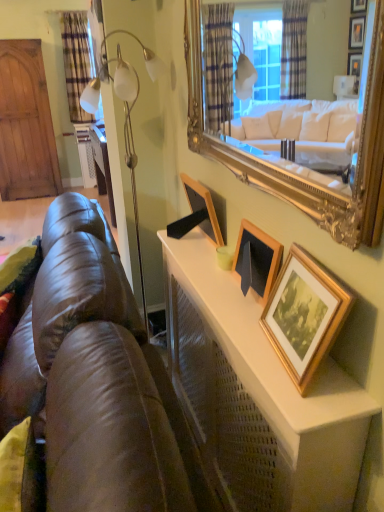
Describe the element at coordinates (303, 169) in the screenshot. Image resolution: width=384 pixels, height=512 pixels. I see `gold ornate mirror at upper center` at that location.

Describe the element at coordinates (304, 315) in the screenshot. This screenshot has width=384, height=512. I see `gold wooden picture frame at upper right, which is the third picture frame from back to front` at that location.

Locate an element on the screen. Image resolution: width=384 pixels, height=512 pixels. wooden picture frame at upper center, which is counted as the third picture frame, starting from the front is located at coordinates tap(203, 207).

Based on their positions, is gold wooden picture frame at upper right, which appears as the 1th picture frame when viewed from the front, located to the left or right of plaid fabric curtain at upper left?

In the image, gold wooden picture frame at upper right, which appears as the 1th picture frame when viewed from the front, appears on the right side of plaid fabric curtain at upper left.

Which object is wider, gold wooden picture frame at upper right, the first picture frame in the right-to-left sequence, or plaid fabric curtain at upper left?

With larger width is plaid fabric curtain at upper left.

This screenshot has width=384, height=512. Find the location of `curtain that appears above the gold wooden picture frame at upper right, which is the third picture frame from back to front (from a real-world perspective)`. curtain that appears above the gold wooden picture frame at upper right, which is the third picture frame from back to front (from a real-world perspective) is located at coordinates pos(76,62).

From a real-world perspective, is gold wooden picture frame at upper right, the first picture frame in the right-to-left sequence, physically above plaid fabric curtain at upper left?

No, from a real-world perspective, gold wooden picture frame at upper right, the first picture frame in the right-to-left sequence, is not over plaid fabric curtain at upper left

Is gold wooden picture frame at upper right, which appears as the 1th picture frame when viewed from the front, far away from brown leather couch at lower left?

gold wooden picture frame at upper right, which appears as the 1th picture frame when viewed from the front, is near brown leather couch at lower left, not far away.

Looking at this image, from the image's perspective, does gold wooden picture frame at upper right, the first picture frame in the right-to-left sequence, appear lower than brown leather couch at lower left?

No, from the image's perspective, gold wooden picture frame at upper right, the first picture frame in the right-to-left sequence, is not beneath brown leather couch at lower left.

In the scene shown: Which object is positioned more to the right, gold wooden picture frame at upper right, which is the third picture frame from back to front, or brown leather couch at lower left?

gold wooden picture frame at upper right, which is the third picture frame from back to front, is more to the right.

In the scene shown: Considering their positions, is gold wooden picture frame at upper right, the third picture frame positioned from the left, located in front of or behind brown leather couch at lower left?

Visually, gold wooden picture frame at upper right, the third picture frame positioned from the left, is located behind brown leather couch at lower left.

From the image's perspective, is gold wooden picture frame at upper right, which appears as the 1th picture frame when viewed from the front, over wooden picture frame at upper center, which is the first picture frame in back-to-front order?

No, from the image's perspective, gold wooden picture frame at upper right, which appears as the 1th picture frame when viewed from the front, is not over wooden picture frame at upper center, which is the first picture frame in back-to-front order.

How different are the orientations of gold wooden picture frame at upper right, which is the third picture frame from back to front, and wooden picture frame at upper center, which ranks as the 1th picture frame in left-to-right order, in degrees?

The angle between the facing direction of gold wooden picture frame at upper right, which is the third picture frame from back to front, and the facing direction of wooden picture frame at upper center, which ranks as the 1th picture frame in left-to-right order, is 0.0124 degrees.

Is gold wooden picture frame at upper right, the first picture frame in the right-to-left sequence, positioned with its back to wooden picture frame at upper center, which is the first picture frame in back-to-front order?

That's not correct — gold wooden picture frame at upper right, the first picture frame in the right-to-left sequence, is not looking away from wooden picture frame at upper center, which is the first picture frame in back-to-front order.

Considering the relative positions of gold wooden picture frame at upper right, the first picture frame in the right-to-left sequence, and wooden picture frame at upper center, which is the first picture frame in back-to-front order, in the image provided, is gold wooden picture frame at upper right, the first picture frame in the right-to-left sequence, to the left of wooden picture frame at upper center, which is the first picture frame in back-to-front order, from the viewer's perspective?

Incorrect, gold wooden picture frame at upper right, the first picture frame in the right-to-left sequence, is not on the left side of wooden picture frame at upper center, which is the first picture frame in back-to-front order.

Which is in front, point (137, 345) or point (199, 14)?

The point (137, 345) is closer to the camera.

Considering the relative sizes of brown leather couch at lower left and gold ornate mirror at upper center in the image provided, is brown leather couch at lower left thinner than gold ornate mirror at upper center?

No.

From a real-world perspective, is brown leather couch at lower left above or below gold ornate mirror at upper center?

brown leather couch at lower left is situated lower than gold ornate mirror at upper center in the real world.

Would you say brown leather couch at lower left is a long distance from gold ornate mirror at upper center?

No, there isn't a large distance between brown leather couch at lower left and gold ornate mirror at upper center.

Would you consider wooden picture frame at center, the 2th picture frame viewed from the left, to be distant from brown leather couch at lower left?

No, wooden picture frame at center, the 2th picture frame viewed from the left, is not far away from brown leather couch at lower left.

This screenshot has width=384, height=512. I want to click on studio couch below the wooden picture frame at center, marked as the 2th picture frame in a right-to-left arrangement (from a real-world perspective), so click(96, 380).

Would you say wooden picture frame at center, the 2th picture frame viewed from the left, is inside or outside brown leather couch at lower left?

wooden picture frame at center, the 2th picture frame viewed from the left, lies outside brown leather couch at lower left.

Is wooden picture frame at upper center, which is the first picture frame in back-to-front order, in contact with gold wooden picture frame at upper right, the first picture frame in the right-to-left sequence?

No, wooden picture frame at upper center, which is the first picture frame in back-to-front order, is not with gold wooden picture frame at upper right, the first picture frame in the right-to-left sequence.

Is wooden picture frame at upper center, which is the first picture frame in back-to-front order, behind gold wooden picture frame at upper right, which is the third picture frame from back to front?

That is True.

Is point (210, 226) closer or farther from the camera than point (288, 270)?

Point (210, 226) appears to be farther away from the viewer than point (288, 270).

Do you think wooden picture frame at upper center, which is counted as the third picture frame, starting from the front, is within gold wooden picture frame at upper right, which is the third picture frame from back to front, or outside of it?

wooden picture frame at upper center, which is counted as the third picture frame, starting from the front, is spatially situated outside gold wooden picture frame at upper right, which is the third picture frame from back to front.

Is gold wooden picture frame at upper right, the first picture frame in the right-to-left sequence, aimed at gold ornate mirror at upper center?

No, gold wooden picture frame at upper right, the first picture frame in the right-to-left sequence, is not aimed at gold ornate mirror at upper center.

From the image's perspective, between gold wooden picture frame at upper right, which appears as the 1th picture frame when viewed from the front, and gold ornate mirror at upper center, who is located below?

gold wooden picture frame at upper right, which appears as the 1th picture frame when viewed from the front, from the image's perspective.

Considering the positions of objects gold wooden picture frame at upper right, which appears as the 1th picture frame when viewed from the front, and gold ornate mirror at upper center in the image provided, who is more to the left, gold wooden picture frame at upper right, which appears as the 1th picture frame when viewed from the front, or gold ornate mirror at upper center?

Positioned to the left is gold ornate mirror at upper center.

Which point is more forward, (283, 322) or (371, 69)?

Positioned in front is point (371, 69).

Find the location of a particular element. This screenshot has width=384, height=512. the 3rd picture frame to the right of the plaid fabric curtain at upper left, starting your count from the anchor is located at coordinates (304, 315).

At what (x,y) coordinates should I click in order to perform the action: click on studio couch below the gold wooden picture frame at upper right, which appears as the 1th picture frame when viewed from the front (from the image's perspective). Please return your answer as a coordinate pair (x, y). This screenshot has height=512, width=384. Looking at the image, I should click on (96, 380).

Looking at the image, which one is located further to plaid fabric curtain at upper left, wooden picture frame at upper center, which is counted as the third picture frame, starting from the front, or wooden picture frame at center, which appears as the second picture frame when viewed from the back?

The object further to plaid fabric curtain at upper left is wooden picture frame at center, which appears as the second picture frame when viewed from the back.

When comparing their distances from gold ornate mirror at upper center, does gold wooden picture frame at upper right, which is the third picture frame from back to front, or wooden picture frame at center, which appears as the second picture frame when viewed from the back, seem closer?

Based on the image, gold wooden picture frame at upper right, which is the third picture frame from back to front, appears to be nearer to gold ornate mirror at upper center.

Estimate the real-world distances between objects in this image. Which object is closer to brown leather couch at lower left, wooden picture frame at upper center, which is the first picture frame in back-to-front order, or gold wooden picture frame at upper right, the first picture frame in the right-to-left sequence?

Among the two, gold wooden picture frame at upper right, the first picture frame in the right-to-left sequence, is located nearer to brown leather couch at lower left.

Estimate the real-world distances between objects in this image. Which object is further from gold wooden picture frame at upper right, which appears as the 1th picture frame when viewed from the front, wooden picture frame at upper center, which is counted as the third picture frame, starting from the right, or brown leather couch at lower left?

wooden picture frame at upper center, which is counted as the third picture frame, starting from the right, is positioned further to the anchor gold wooden picture frame at upper right, which appears as the 1th picture frame when viewed from the front.

Estimate the real-world distances between objects in this image. Which object is closer to wooden picture frame at upper center, which is counted as the third picture frame, starting from the right, plaid fabric curtain at upper left or wooden picture frame at center, which appears as the second picture frame when viewed from the back?

wooden picture frame at center, which appears as the second picture frame when viewed from the back, is closer to wooden picture frame at upper center, which is counted as the third picture frame, starting from the right.

Which object lies further to the anchor point wooden picture frame at center, which appears as the second picture frame when viewed from the back, gold wooden picture frame at upper right, which is the third picture frame from back to front, or gold ornate mirror at upper center?

Based on the image, gold ornate mirror at upper center appears to be further to wooden picture frame at center, which appears as the second picture frame when viewed from the back.

When comparing their distances from plaid fabric curtain at upper left, does gold ornate mirror at upper center or brown leather couch at lower left seem closer?

Based on the image, brown leather couch at lower left appears to be nearer to plaid fabric curtain at upper left.

Looking at the image, which one is located closer to wooden picture frame at upper center, which ranks as the 1th picture frame in left-to-right order, gold wooden picture frame at upper right, the third picture frame positioned from the left, or brown leather couch at lower left?

Based on the image, gold wooden picture frame at upper right, the third picture frame positioned from the left, appears to be nearer to wooden picture frame at upper center, which ranks as the 1th picture frame in left-to-right order.

At what (x,y) coordinates should I click in order to perform the action: click on mirror positioned between brown leather couch at lower left and wooden picture frame at upper center, which is the first picture frame in back-to-front order, from near to far. Please return your answer as a coordinate pair (x, y). The width and height of the screenshot is (384, 512). Looking at the image, I should click on (303, 169).

The width and height of the screenshot is (384, 512). I want to click on picture frame located between wooden picture frame at center, the 2th picture frame viewed from the left, and plaid fabric curtain at upper left in the depth direction, so click(x=203, y=207).

You are a GUI agent. You are given a task and a screenshot of the screen. Output one action in this format:
    pyautogui.click(x=<x>, y=<y>)
    Task: Click on the mirror between brown leather couch at lower left and plaid fabric curtain at upper left from front to back
    
    Given the screenshot: What is the action you would take?
    pyautogui.click(x=303, y=169)

Where is `picture frame located between gold wooden picture frame at upper right, the first picture frame in the right-to-left sequence, and wooden picture frame at upper center, which ranks as the 1th picture frame in left-to-right order, in the depth direction`? This screenshot has height=512, width=384. picture frame located between gold wooden picture frame at upper right, the first picture frame in the right-to-left sequence, and wooden picture frame at upper center, which ranks as the 1th picture frame in left-to-right order, in the depth direction is located at coordinates (258, 258).